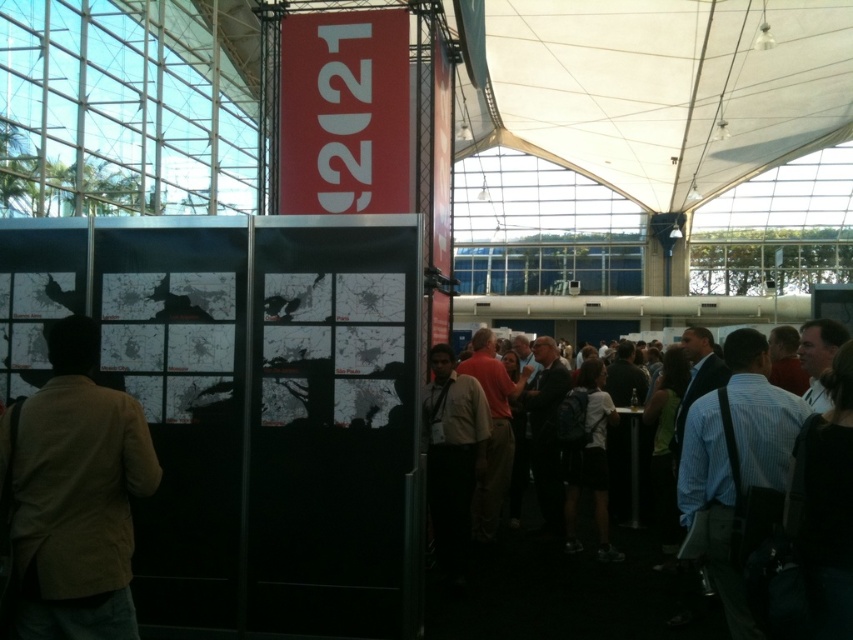
Between dark clothing crowd at lower right and blue striped shirt at right, which one appears on the left side from the viewer's perspective?

dark clothing crowd at lower right is more to the left.

Is dark clothing crowd at lower right to the left of blue striped shirt at right from the viewer's perspective?

Correct, you'll find dark clothing crowd at lower right to the left of blue striped shirt at right.

Is point (444, 593) positioned after point (795, 435)?

Yes, point (444, 593) is farther from viewer.

In order to click on dark clothing crowd at lower right in this screenshot , I will do `click(570, 589)`.

Can you confirm if white fabric canopy at upper center is smaller than blue striped shirt at right?

Incorrect, white fabric canopy at upper center is not smaller in size than blue striped shirt at right.

Can you confirm if white fabric canopy at upper center is positioned to the left of blue striped shirt at right?

In fact, white fabric canopy at upper center is to the right of blue striped shirt at right.

The height and width of the screenshot is (640, 853). In order to click on white fabric canopy at upper center in this screenshot , I will do `click(669, 88)`.

At what (x,y) coordinates should I click in order to perform the action: click on white fabric canopy at upper center. Please return your answer as a coordinate pair (x, y). The width and height of the screenshot is (853, 640). Looking at the image, I should click on [669, 88].

Is point (56, 323) positioned before point (738, 420)?

Yes, it is.

Who is shorter, light brown textured blazer at left or blue striped shirt at right?

blue striped shirt at right

Locate an element on the screen. This screenshot has width=853, height=640. light brown textured blazer at left is located at coordinates (74, 496).